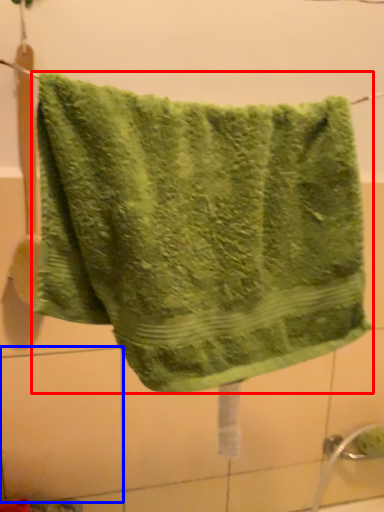
Question: Among these objects, which one is farthest to the camera, towel (highlighted by a red box) or tile (highlighted by a blue box)?

Choices:
 (A) towel
 (B) tile

Answer: (B)